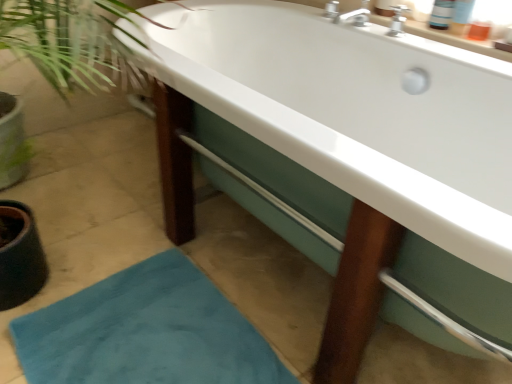
Question: Relative to white glossy bathtub at center, is teal plush bath mat at lower left in front or behind?

Choices:
 (A) behind
 (B) front

Answer: (A)

Question: From a real-world perspective, is teal plush bath mat at lower left physically located above or below white glossy bathtub at center?

Choices:
 (A) below
 (B) above

Answer: (A)

Question: Based on their sizes in the image, would you say teal plush bath mat at lower left is bigger or smaller than white glossy bathtub at center?

Choices:
 (A) big
 (B) small

Answer: (B)

Question: Relative to teal plush bath mat at lower left, is white glossy bathtub at center in front or behind?

Choices:
 (A) behind
 (B) front

Answer: (B)

Question: Does point [334, 82] appear closer or farther from the camera than point [197, 304]?

Choices:
 (A) closer
 (B) farther

Answer: (B)

Question: From a real-world perspective, is white glossy bathtub at center physically located above or below teal plush bath mat at lower left?

Choices:
 (A) below
 (B) above

Answer: (B)

Question: From the image's perspective, relative to teal plush bath mat at lower left, is white glossy bathtub at center above or below?

Choices:
 (A) below
 (B) above

Answer: (B)